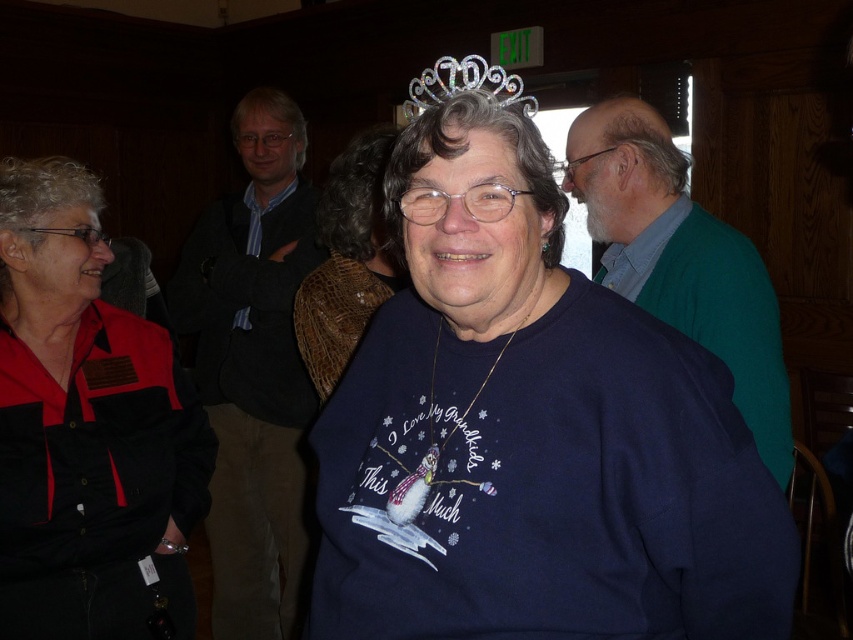
Is black fabric shirt at center to the left of brown woven shawl at center from the viewer's perspective?

Correct, you'll find black fabric shirt at center to the left of brown woven shawl at center.

Find the location of a particular element. The width and height of the screenshot is (853, 640). black fabric shirt at center is located at coordinates (86, 428).

Is point (102, 301) farther from camera compared to point (339, 362)?

No, it is not.

You are a GUI agent. You are given a task and a screenshot of the screen. Output one action in this format:
    pyautogui.click(x=<x>, y=<y>)
    Task: Click on the black fabric shirt at center
    
    Given the screenshot: What is the action you would take?
    pyautogui.click(x=86, y=428)

Consider the image. Is black fabric shirt at center positioned behind clear plastic tiara at upper center?

Yes, black fabric shirt at center is behind clear plastic tiara at upper center.

The width and height of the screenshot is (853, 640). What are the coordinates of `black fabric shirt at center` in the screenshot? It's located at (86, 428).

In order to click on black fabric shirt at center in this screenshot , I will do `click(86, 428)`.

Is point (311, 365) positioned before point (456, 70)?

That is False.

Does brown woven shawl at center appear under clear plastic tiara at upper center?

Correct, brown woven shawl at center is located below clear plastic tiara at upper center.

Between point (368, 244) and point (422, 99), which one is positioned in front?

Point (422, 99) is more forward.

At what (x,y) coordinates should I click in order to perform the action: click on brown woven shawl at center. Please return your answer as a coordinate pair (x, y). This screenshot has width=853, height=640. Looking at the image, I should click on (346, 260).